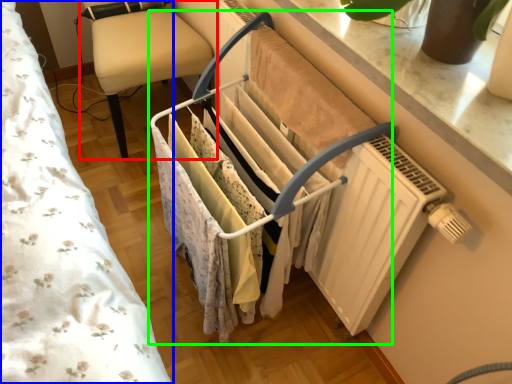
Question: Which object is positioned farthest from furniture (highlighted by a red box)? Select from bed (highlighted by a blue box) and closet (highlighted by a green box).

Choices:
 (A) bed
 (B) closet

Answer: (B)